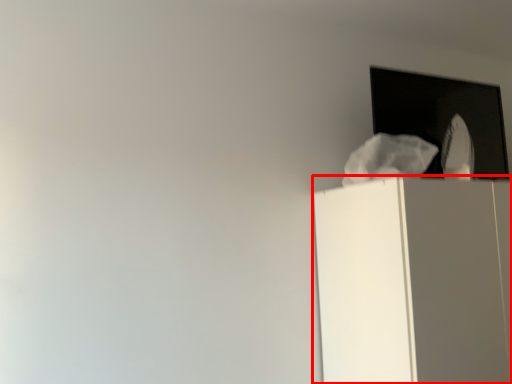
Question: From the image's perspective, what is the correct spatial relationship of furniture (annotated by the red box) in relation to window?

Choices:
 (A) below
 (B) above

Answer: (A)